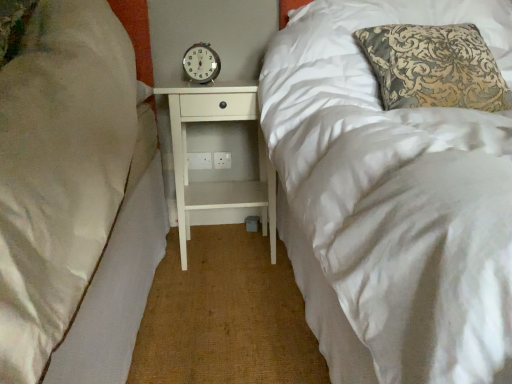
Where is `vacant area in front of white wood nightstand at center`? The width and height of the screenshot is (512, 384). vacant area in front of white wood nightstand at center is located at coordinates (222, 292).